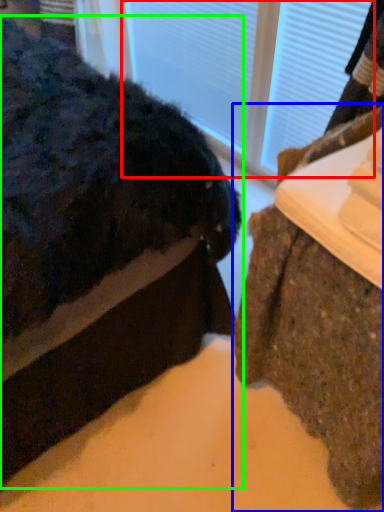
Question: Which object is positioned farthest from glass door (highlighted by a red box)? Select from furniture (highlighted by a blue box) and furniture (highlighted by a green box).

Choices:
 (A) furniture
 (B) furniture

Answer: (A)